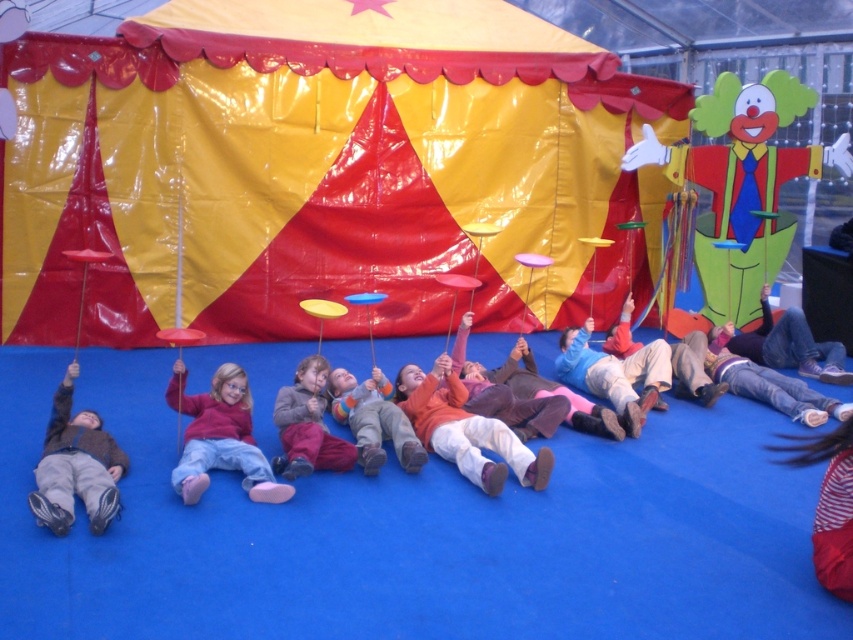
You are standing in front of the circus tent and see two points marked in the scene. Which point is closer to you, point (479, 29) or point (381, 412)?

Point (479, 29) is further to the viewer than point (381, 412), so the closer point to you is point (381, 412).